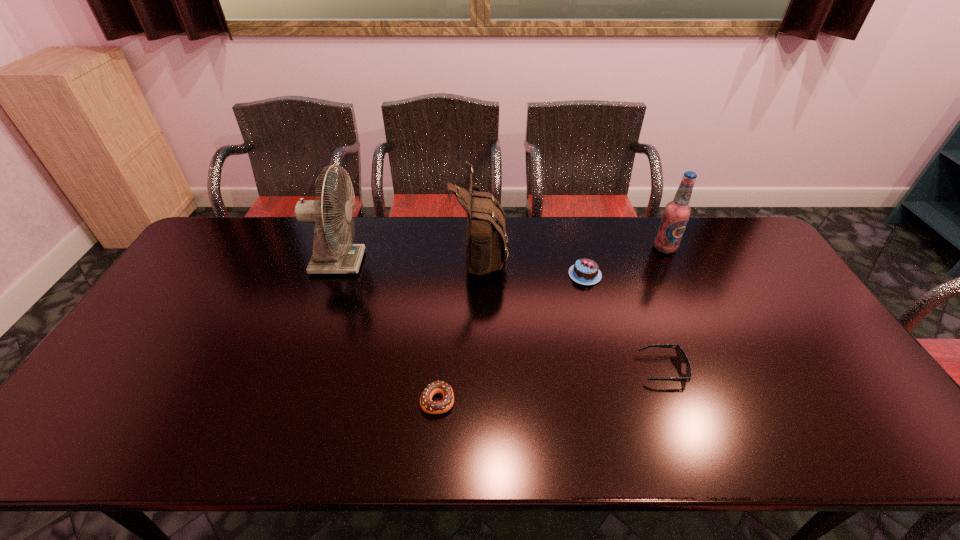
Locate an element on the screen. This screenshot has height=540, width=960. vacant space at the near edge of the desktop is located at coordinates (671, 455).

You are a GUI agent. You are given a task and a screenshot of the screen. Output one action in this format:
    pyautogui.click(x=<x>, y=<y>)
    Task: Click on the free space at the right edge
    
    Given the screenshot: What is the action you would take?
    pyautogui.click(x=781, y=280)

You are a GUI agent. You are given a task and a screenshot of the screen. Output one action in this format:
    pyautogui.click(x=<x>, y=<y>)
    Task: Click on the free space at the near left corner of the desktop
    
    Given the screenshot: What is the action you would take?
    pyautogui.click(x=119, y=439)

Locate an element on the screen. free space at the far right corner of the desktop is located at coordinates (700, 217).

In the image, there is a desktop. Identify the location of vacant space at the near right corner. (854, 420).

At what (x,y) coordinates should I click in order to perform the action: click on empty space that is in between the shoulder bag and the doughnut. Please return your answer as a coordinate pair (x, y). The height and width of the screenshot is (540, 960). Looking at the image, I should click on (459, 326).

Image resolution: width=960 pixels, height=540 pixels. What are the coordinates of `free spot between the shoulder bag and the doughnut` in the screenshot? It's located at (459, 326).

The image size is (960, 540). What are the coordinates of `free space that is in between the fourth shortest object and the chocolate cake` in the screenshot? It's located at (625, 261).

This screenshot has width=960, height=540. I want to click on empty location between the fifth object from left to right and the shoulder bag, so click(571, 310).

In order to click on vacant area that lies between the doughnut and the rightmost object in this screenshot , I will do `click(551, 324)`.